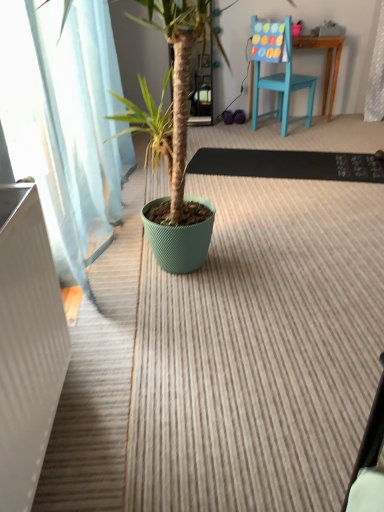
Question: From the image's perspective, is teal wooden chair at upper right above or below rug at center, the 2th doormat positioned from the top?

Choices:
 (A) above
 (B) below

Answer: (A)

Question: In terms of size, does teal wooden chair at upper right appear bigger or smaller than rug at center, the first doormat in the bottom-to-top sequence?

Choices:
 (A) big
 (B) small

Answer: (B)

Question: Which object is the closest to the teal wooden chair at upper right?

Choices:
 (A) black rubber doormat at center, the 2th doormat positioned from the bottom
 (B) rug at center, the first doormat in the bottom-to-top sequence
 (C) white ribbed radiator at left

Answer: (A)

Question: Estimate the real-world distances between objects in this image. Which object is closer to the teal wooden chair at upper right?

Choices:
 (A) rug at center, the 2th doormat positioned from the top
 (B) white ribbed radiator at left
 (C) black rubber doormat at center, the 2th doormat positioned from the bottom

Answer: (C)